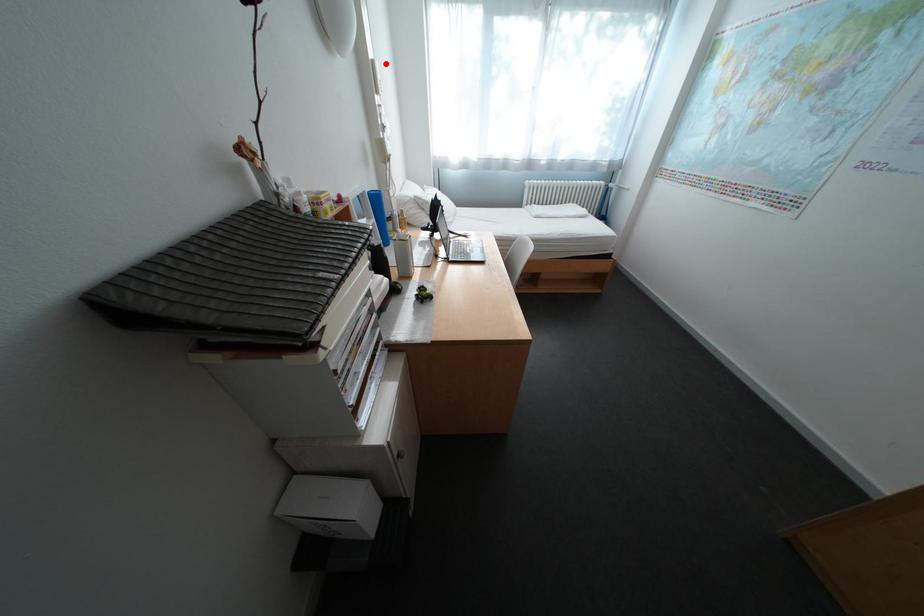
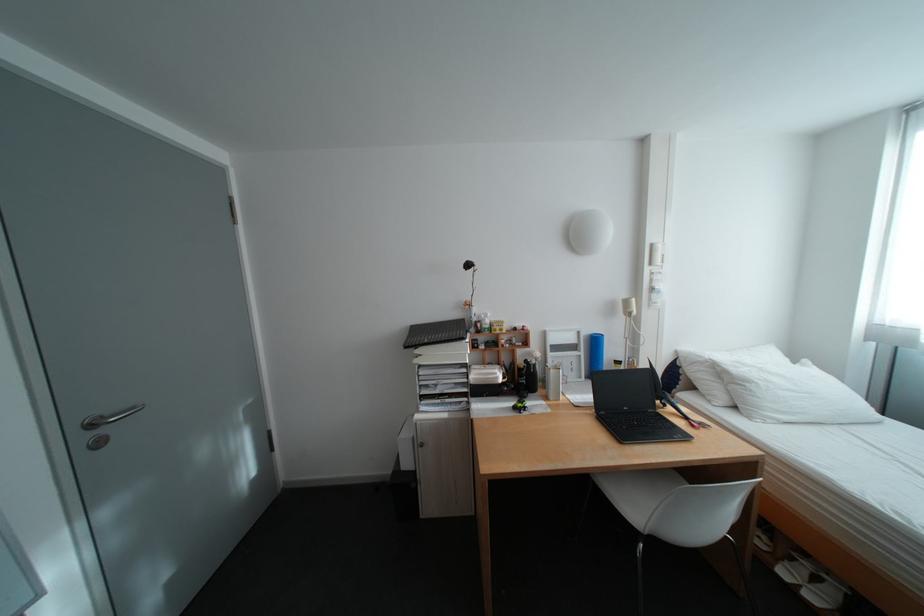
Locate, in the second image, the point that corresponds to the highlighted location in the first image.

(664, 246)